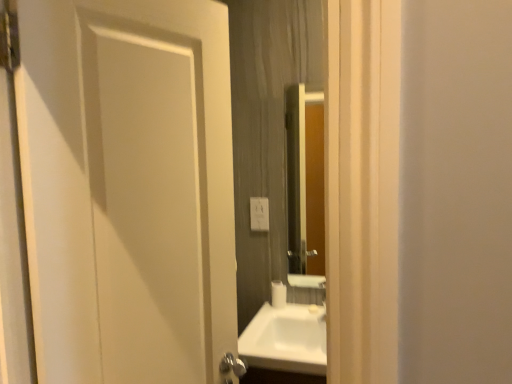
Question: Looking at the image, does white plastic electric outlet at center seem bigger or smaller compared to smooth wooden mirror at center?

Choices:
 (A) big
 (B) small

Answer: (B)

Question: Is white plastic electric outlet at center in front of or behind smooth wooden mirror at center in the image?

Choices:
 (A) behind
 (B) front

Answer: (A)

Question: Based on their relative distances, which object is farther from the white glossy sink at center?

Choices:
 (A) white matte toilet paper at center
 (B) smooth wooden mirror at center
 (C) white plastic electric outlet at center
 (D) white matte door at left

Answer: (B)

Question: Which of these objects is positioned farthest from the white matte toilet paper at center?

Choices:
 (A) smooth wooden mirror at center
 (B) white glossy sink at center
 (C) white matte door at left
 (D) white plastic electric outlet at center

Answer: (C)